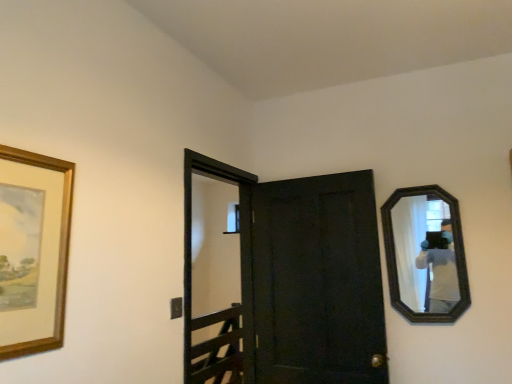
Question: Is matte black door at center not near dark wood mirror at right?

Choices:
 (A) yes
 (B) no

Answer: (B)

Question: From the image's perspective, is matte black door at center above dark wood mirror at right?

Choices:
 (A) no
 (B) yes

Answer: (A)

Question: Could you tell me if matte black door at center is turned towards dark wood mirror at right?

Choices:
 (A) no
 (B) yes

Answer: (A)

Question: Can dark wood mirror at right be found inside matte black door at center?

Choices:
 (A) yes
 (B) no

Answer: (B)

Question: Is matte black door at center at the left side of dark wood mirror at right?

Choices:
 (A) yes
 (B) no

Answer: (A)

Question: Considering the relative positions of dark wood mirror at right and matte black door at center in the image provided, is dark wood mirror at right to the left or to the right of matte black door at center?

Choices:
 (A) left
 (B) right

Answer: (B)

Question: Based on their sizes in the image, would you say dark wood mirror at right is bigger or smaller than matte black door at center?

Choices:
 (A) big
 (B) small

Answer: (B)

Question: Is dark wood mirror at right inside or outside of matte black door at center?

Choices:
 (A) inside
 (B) outside

Answer: (B)

Question: In terms of height, does dark wood mirror at right look taller or shorter compared to matte black door at center?

Choices:
 (A) short
 (B) tall

Answer: (A)

Question: From a real-world perspective, is matte black door at center above or below dark wood mirror at right?

Choices:
 (A) above
 (B) below

Answer: (B)

Question: In terms of width, does matte black door at center look wider or thinner when compared to dark wood mirror at right?

Choices:
 (A) thin
 (B) wide

Answer: (B)

Question: Considering their positions, is matte black door at center located in front of or behind dark wood mirror at right?

Choices:
 (A) front
 (B) behind

Answer: (A)

Question: Considering the positions of point (x=194, y=354) and point (x=428, y=307), is point (x=194, y=354) closer or farther from the camera than point (x=428, y=307)?

Choices:
 (A) closer
 (B) farther

Answer: (B)

Question: Is point (32, 240) positioned closer to the camera than point (440, 292)?

Choices:
 (A) closer
 (B) farther

Answer: (A)

Question: Considering the positions of wooden picture frame at left and dark wood mirror at right in the image, is wooden picture frame at left taller or shorter than dark wood mirror at right?

Choices:
 (A) tall
 (B) short

Answer: (B)